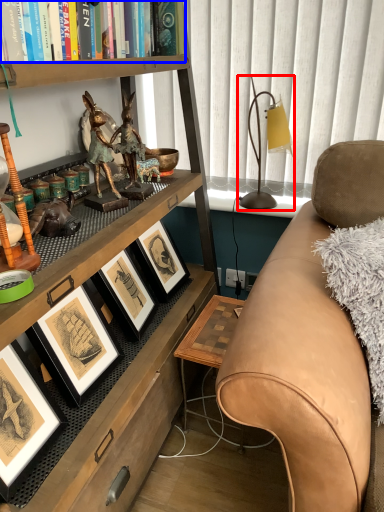
Question: Which of the following is the farthest to the observer, table lamp (highlighted by a red box) or book (highlighted by a blue box)?

Choices:
 (A) table lamp
 (B) book

Answer: (A)